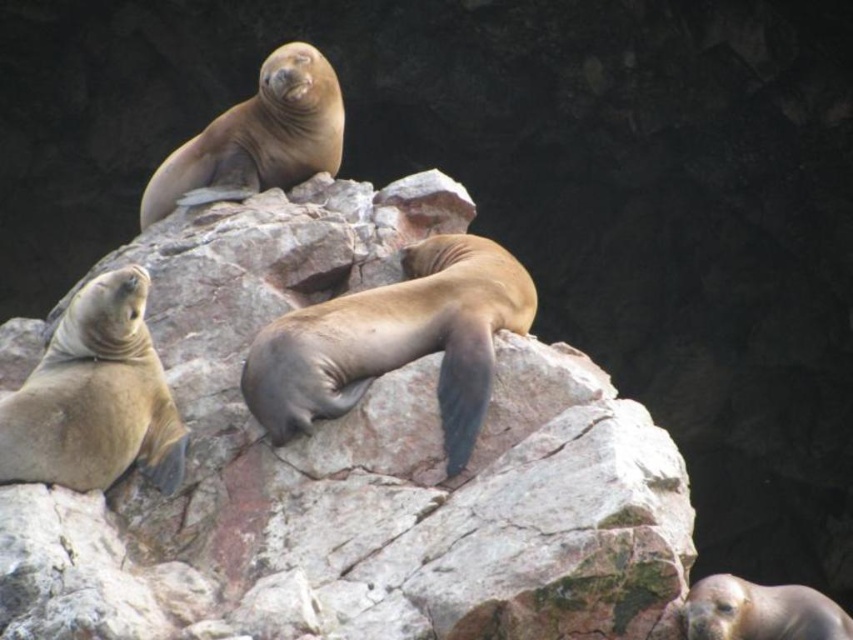
Who is taller, brown rough rock at center or brown smooth seal at center?

With more height is brown rough rock at center.

Can you confirm if brown rough rock at center is taller than brown smooth seal at center?

Indeed, brown rough rock at center has a greater height compared to brown smooth seal at center.

In the scene shown: Who is more forward, (480, 634) or (469, 451)?

Point (480, 634) is in front.

Image resolution: width=853 pixels, height=640 pixels. In order to click on brown rough rock at center in this screenshot , I will do [x=354, y=468].